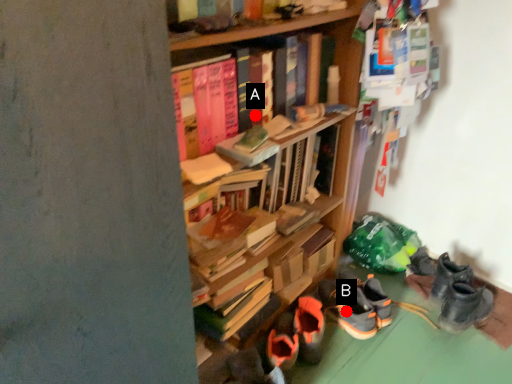
Question: Two points are circled on the image, labeled by A and B beside each circle. Which point appears closest to the camera in this image?

Choices:
 (A) A is closer
 (B) B is closer

Answer: (A)